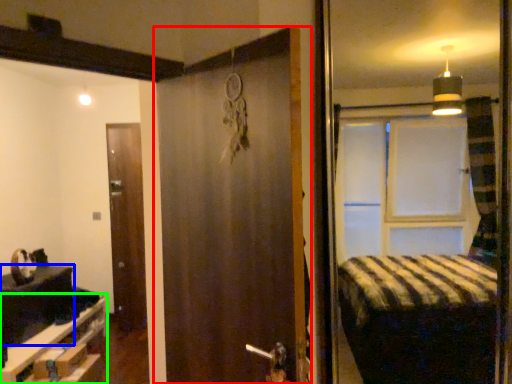
Question: Considering the real-world distances, which object is farthest from door (highlighted by a red box)? table (highlighted by a blue box) or furniture (highlighted by a green box)?

Choices:
 (A) table
 (B) furniture

Answer: (A)